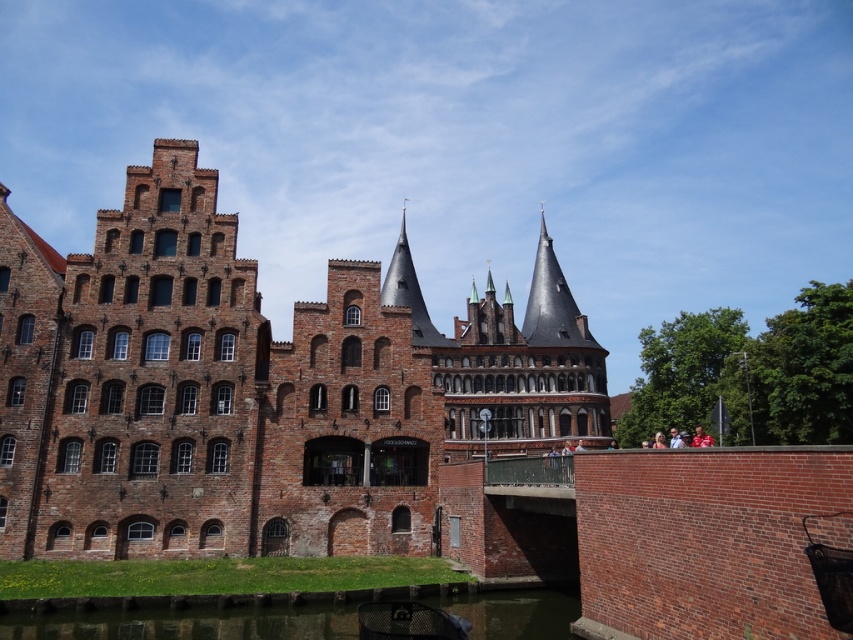
You are a tourist standing on the green grassy bank at lower left and want to take a photo of the brown brick castle at center. Which direction should you face to capture the castle in your view?

You should face upward because the brown brick castle at center is located above the green grassy bank at lower left.

You are a tourist standing on the green grassy bank at lower left and want to take a photo of the brown brick castle at center. Since the castle is larger, where should you position yourself to ensure the entire castle fits in your camera frame?

The brown brick castle at center is bigger than the green grassy bank at lower left, so you should move further away from the castle to ensure the entire structure fits within your camera frame.